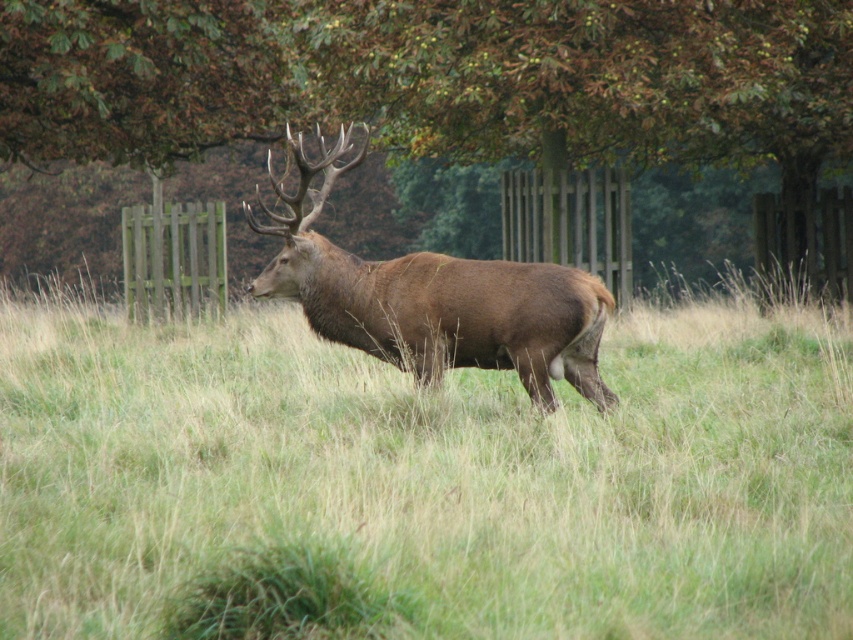
Question: Among these objects, which one is nearest to the camera?

Choices:
 (A) brown velvet deer at center
 (B) brown matte grass at center

Answer: (B)

Question: Can you confirm if brown matte grass at center is smaller than brown velvet deer at center?

Choices:
 (A) no
 (B) yes

Answer: (A)

Question: Which object appears farthest from the camera in this image?

Choices:
 (A) brown velvet deer at center
 (B) green leafy tree at upper center
 (C) brown matte grass at center

Answer: (B)

Question: Is brown matte grass at center bigger than green leafy tree at upper center?

Choices:
 (A) yes
 (B) no

Answer: (B)

Question: Is brown matte grass at center below brown velvet deer at center?

Choices:
 (A) no
 (B) yes

Answer: (B)

Question: Which is farther from the brown matte grass at center?

Choices:
 (A) green leafy tree at upper center
 (B) brown velvet deer at center

Answer: (A)